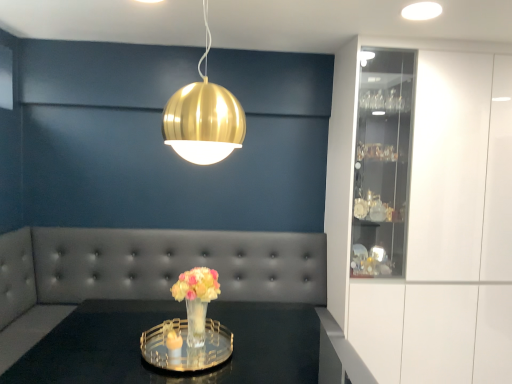
Question: From a real-world perspective, is translucent glass vase at center positioned above or below clear glass tray at center?

Choices:
 (A) above
 (B) below

Answer: (A)

Question: Looking at the image, does translucent glass vase at center seem bigger or smaller compared to clear glass tray at center?

Choices:
 (A) big
 (B) small

Answer: (B)

Question: Which of these objects is positioned closest to the tufted leather couch at center?

Choices:
 (A) white glossy cabinet at right
 (B) gold metallic sphere at upper center
 (C) clear glass tray at center
 (D) translucent glass vase at center

Answer: (C)

Question: Which of these objects is positioned closest to the clear glass tray at center?

Choices:
 (A) translucent glass vase at center
 (B) tufted leather couch at center
 (C) white glossy cabinet at right
 (D) gold metallic sphere at upper center

Answer: (B)